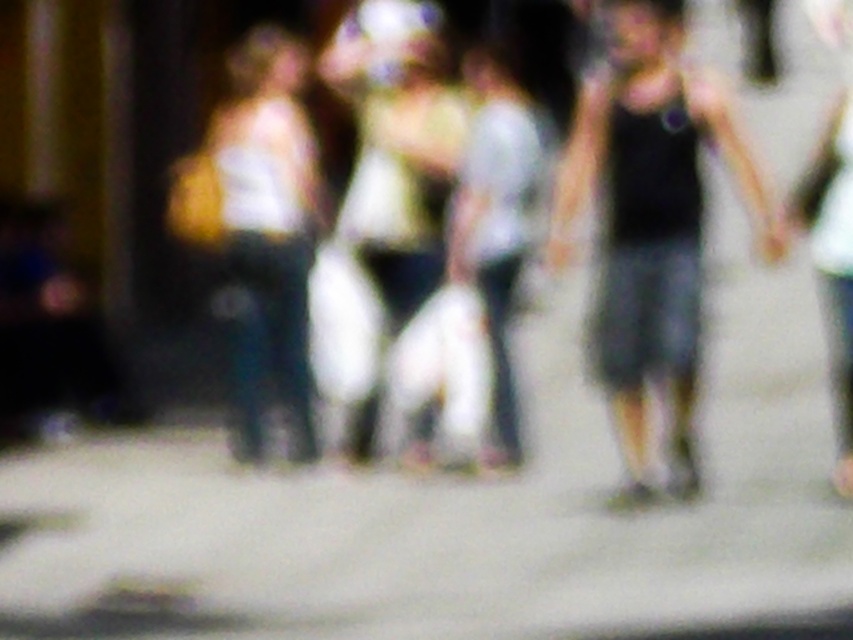
Is black tank top at right above matte yellow bag at left?

Incorrect, black tank top at right is not positioned above matte yellow bag at left.

Does black tank top at right appear on the right side of matte yellow bag at left?

Yes, black tank top at right is to the right of matte yellow bag at left.

Does point (607, 80) come closer to viewer compared to point (302, 442)?

No, (607, 80) is behind (302, 442).

Identify the location of black tank top at right. (650, 221).

Between matte yellow bag at left and white plastic bag at center, which one appears on the left side from the viewer's perspective?

From the viewer's perspective, matte yellow bag at left appears more on the left side.

What do you see at coordinates (262, 230) in the screenshot?
I see `matte yellow bag at left` at bounding box center [262, 230].

This screenshot has height=640, width=853. I want to click on matte yellow bag at left, so click(262, 230).

Where is `matte yellow bag at left`? matte yellow bag at left is located at coordinates (262, 230).

Is black tank top at right positioned before white plastic bag at center?

Yes, it is.

Is point (763, 186) farther from viewer compared to point (408, 195)?

No.

The width and height of the screenshot is (853, 640). Identify the location of black tank top at right. (650, 221).